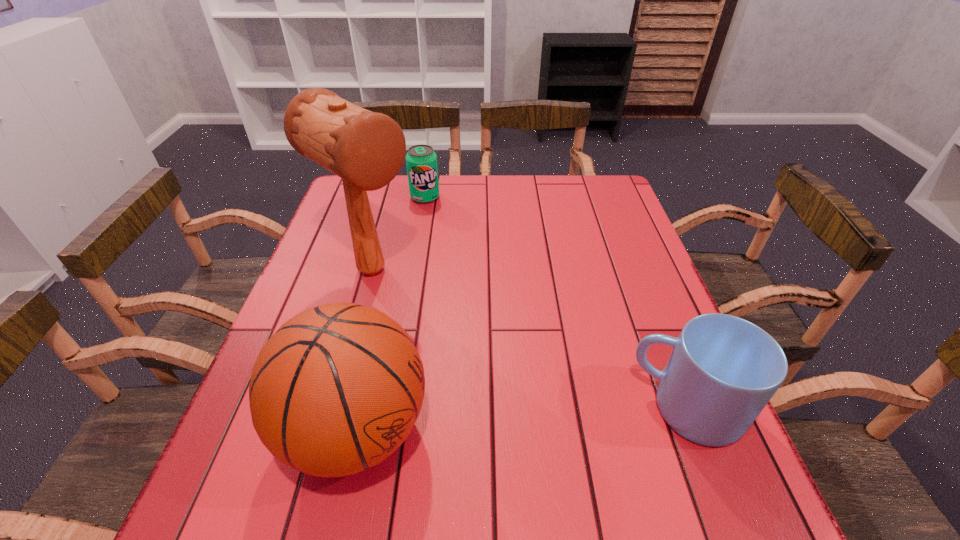
Locate an element on the screen. This screenshot has width=960, height=540. the second tallest object is located at coordinates (337, 389).

Image resolution: width=960 pixels, height=540 pixels. I want to click on mug, so click(723, 370).

Where is `the tallest object`? The height and width of the screenshot is (540, 960). the tallest object is located at coordinates (366, 149).

Locate an element on the screen. This screenshot has height=540, width=960. the second farthest object is located at coordinates (366, 149).

Locate an element on the screen. This screenshot has width=960, height=540. the farthest object is located at coordinates (421, 161).

Identify the location of free spot located 0.120m on the back of the third shortest object. The image size is (960, 540). (380, 326).

This screenshot has height=540, width=960. In order to click on free location located 0.080m on the back of the rightmost object in this screenshot , I will do `click(661, 344)`.

The height and width of the screenshot is (540, 960). Identify the location of vacant space located 0.320m on the strike surface of the second farthest object. (502, 368).

Identify the location of vacant space located on the strike surface of the second farthest object. The width and height of the screenshot is (960, 540). (465, 340).

This screenshot has height=540, width=960. What are the coordinates of `vacant space located on the strike surface of the second farthest object` in the screenshot? It's located at (428, 312).